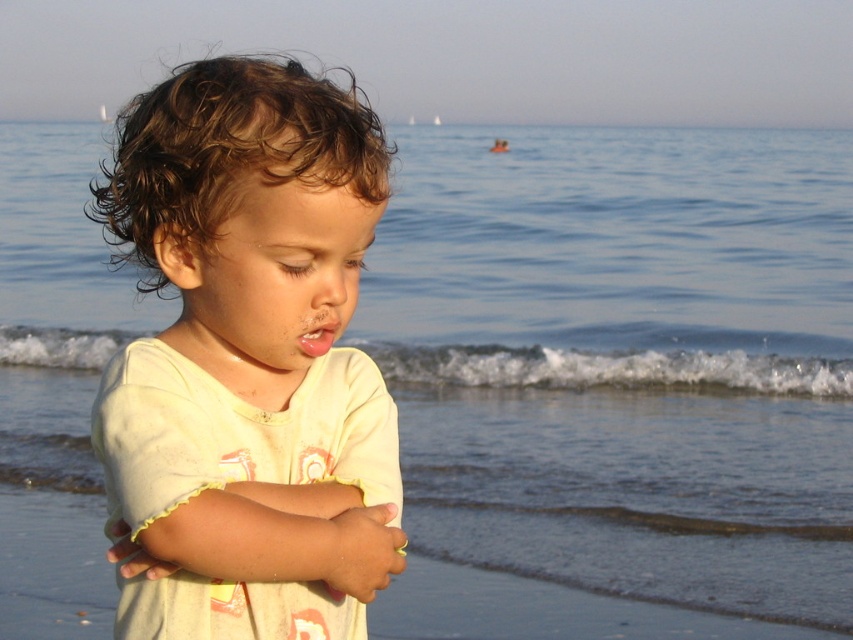
The child in the image is wearing a light yellow cotton shirt at center and has pink matte lips at center. If the child bends forward, which item might become visible that was previously covered?

The light yellow cotton shirt at center is positioned over the pink matte lips at center. When the child bends forward, the pink matte lips at center might become visible as the shirt moves away from that area.

The child in the image is wearing a light yellow cotton shirt at center and has pink matte lips at center. Which of these two features is wider?

The light yellow cotton shirt at center is wider than the pink matte lips at center.

From the picture: You are a photographer trying to capture a closeup of the child in the scene. You want to focus on the light yellow cotton shirt at center and the pink matte lips at center. Can you fit both of them into your camera frame if the maximum distance your camera can capture between two objects is 3 inches?

The light yellow cotton shirt at center and pink matte lips at center are 3.28 inches apart, which exceeds the camera frame limit of 3 inches. Therefore, both cannot be captured in the same frame.